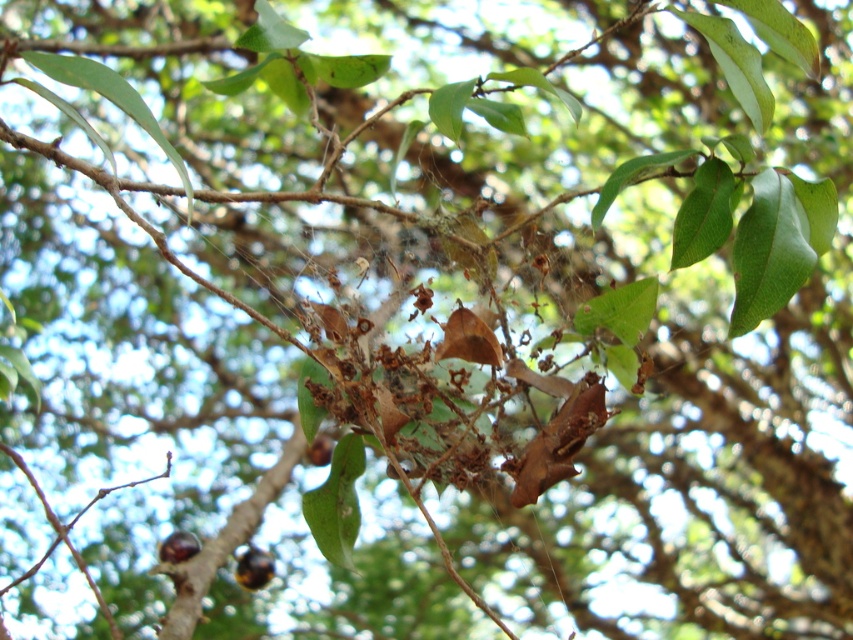
In the scene shown: You are a squirrel looking for food. You see a shiny brown nut at lower left and a brown matte fruit at center. Which one is smaller?

The shiny brown nut at lower left is smaller than the brown matte fruit at center.

You are a squirrel trying to find the closest shiny brown nut to collect. You see the shiny brown nut at lower center and the shiny brown nut at lower left. Which one is closer to you?

The shiny brown nut at lower center is closer to you because it is further to the viewer than the shiny brown nut at lower left, meaning it is positioned nearer in the scene.

Looking at this image, you are a squirrel trying to collect shiny brown nuts. You see two shiny brown nuts in the tree branch web. How far apart are the shiny brown nut at lower center and the shiny brown nut at lower left?

The distance between the shiny brown nut at lower center and the shiny brown nut at lower left is 15.94 inches.